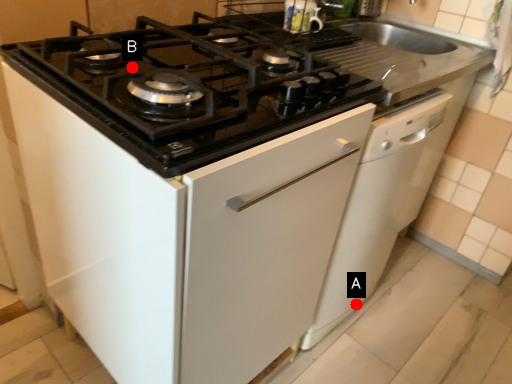
Question: Two points are circled on the image, labeled by A and B beside each circle. Which point appears closest to the camera in this image?

Choices:
 (A) A is closer
 (B) B is closer

Answer: (B)